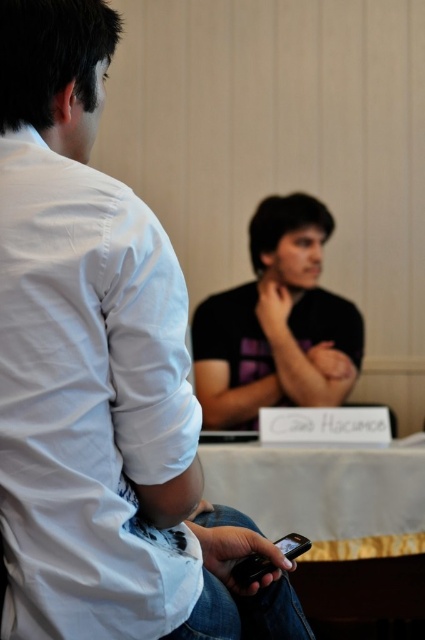
Who is lower down, white fabric table at center or black matte shirt at center?

white fabric table at center is lower down.

The width and height of the screenshot is (425, 640). What do you see at coordinates (337, 525) in the screenshot?
I see `white fabric table at center` at bounding box center [337, 525].

Does point (340, 516) lie in front of point (241, 324)?

Yes, point (340, 516) is closer to viewer.

I want to click on white fabric table at center, so click(337, 525).

Is matte black phone at center wider than white fabric table at center?

No.

Which is below, matte black phone at center or white fabric table at center?

white fabric table at center

Identify the location of matte black phone at center. The height and width of the screenshot is (640, 425). (99, 376).

I want to click on matte black phone at center, so click(99, 376).

Is matte black phone at center thinner than black matte shirt at center?

Correct, matte black phone at center's width is less than black matte shirt at center's.

How far apart are matte black phone at center and black matte shirt at center?

A distance of 7.53 feet exists between matte black phone at center and black matte shirt at center.

Between point (167, 372) and point (268, 401), which one is positioned in front?

Point (167, 372) is more forward.

Locate an element on the screen. Image resolution: width=425 pixels, height=640 pixels. matte black phone at center is located at coordinates (99, 376).